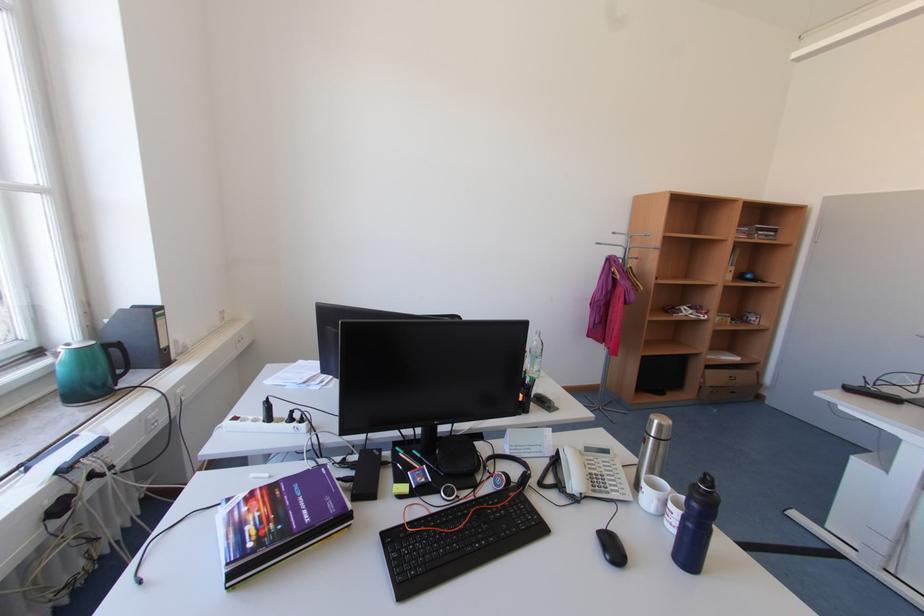
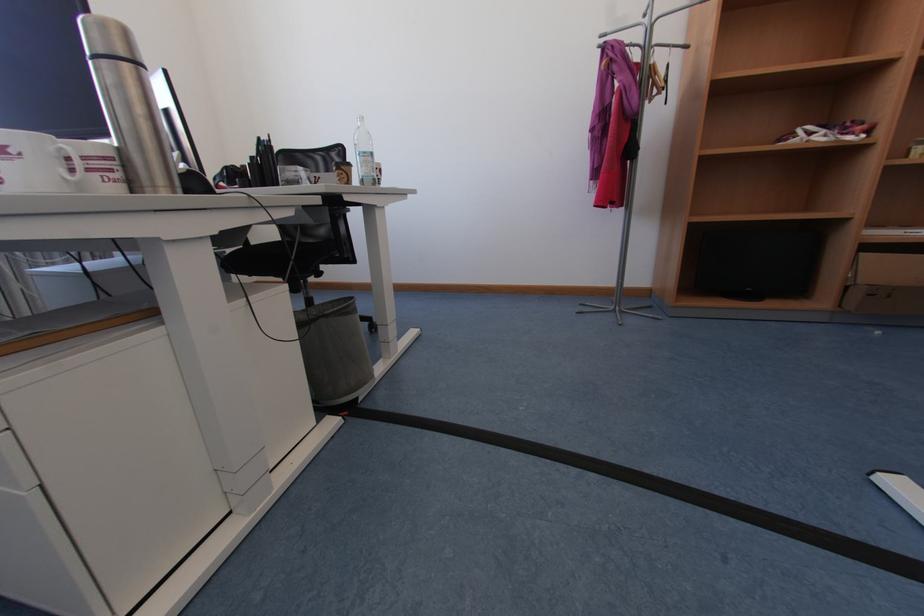
In a continuous first-person perspective shot, in which direction is the camera moving?

The movement direction of the cameraman is right, forward.